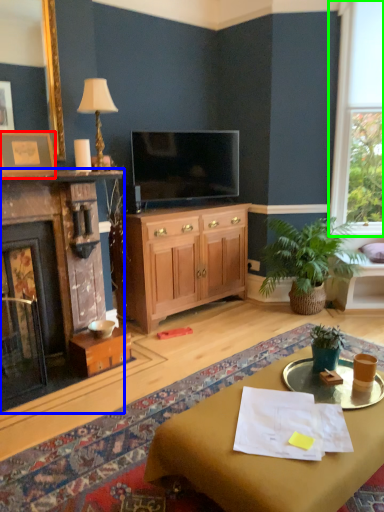
Question: Based on their relative distances, which object is nearer to picture frame (highlighted by a red box)? Choose from fireplace (highlighted by a blue box) and window (highlighted by a green box).

Choices:
 (A) fireplace
 (B) window

Answer: (A)